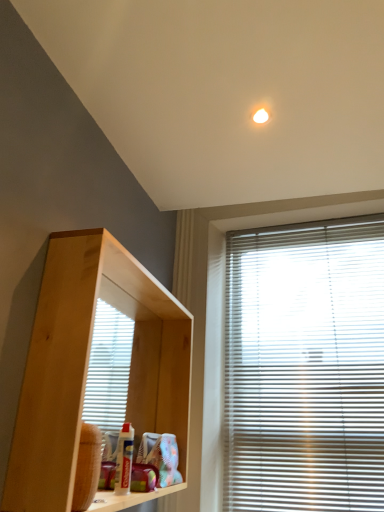
Locate an element on the screen. This screenshot has height=512, width=384. natural wood shelf at center is located at coordinates (88, 364).

What is the approximate width of natural wood shelf at center?

It is 14.93 centimeters.

This screenshot has width=384, height=512. What do you see at coordinates (88, 364) in the screenshot? I see `natural wood shelf at center` at bounding box center [88, 364].

The width and height of the screenshot is (384, 512). Describe the element at coordinates (305, 367) in the screenshot. I see `white plastic blinds at right` at that location.

Image resolution: width=384 pixels, height=512 pixels. What are the coordinates of `white plastic blinds at right` in the screenshot? It's located at (305, 367).

Image resolution: width=384 pixels, height=512 pixels. In order to click on natural wood shelf at center in this screenshot , I will do `click(88, 364)`.

Does natural wood shelf at center appear on the right side of white plastic blinds at right?

No.

In the image, is natural wood shelf at center positioned in front of or behind white plastic blinds at right?

natural wood shelf at center is in front of white plastic blinds at right.

Which is in front, point (27, 423) or point (286, 382)?

The point (27, 423) is in front.

From the image's perspective, which object appears higher, natural wood shelf at center or white plastic blinds at right?

natural wood shelf at center.

From a real-world perspective, which object stands above the other?

white plastic blinds at right.

Can you confirm if natural wood shelf at center is thinner than white plastic blinds at right?

No.

From the picture: In terms of height, does natural wood shelf at center look taller or shorter compared to white plastic blinds at right?

In the image, natural wood shelf at center appears to be shorter than white plastic blinds at right.

Can you confirm if natural wood shelf at center is bigger than white plastic blinds at right?

Yes, natural wood shelf at center is bigger than white plastic blinds at right.

Would you say natural wood shelf at center is inside or outside white plastic blinds at right?

The correct answer is: outside.

Are natural wood shelf at center and white plastic blinds at right far apart?

No, there isn't a large distance between natural wood shelf at center and white plastic blinds at right.

Is natural wood shelf at center facing away from white plastic blinds at right?

No, natural wood shelf at center's orientation is not away from white plastic blinds at right.

How many degrees apart are the facing directions of natural wood shelf at center and white plastic blinds at right?

natural wood shelf at center and white plastic blinds at right are facing 89.7 degrees away from each other.

Where is `window blind that is below the natural wood shelf at center (from the image's perspective)`? This screenshot has width=384, height=512. window blind that is below the natural wood shelf at center (from the image's perspective) is located at coordinates (305, 367).

Does white plastic blinds at right appear on the left side of natural wood shelf at center?

No.

Which object is closer to the camera, white plastic blinds at right or natural wood shelf at center?

Positioned in front is natural wood shelf at center.

Considering the positions of point (277, 285) and point (133, 275), is point (277, 285) closer or farther from the camera than point (133, 275)?

Point (277, 285) is positioned farther from the camera compared to point (133, 275).

From the image's perspective, is white plastic blinds at right located above natural wood shelf at center?

No, from the image's perspective, white plastic blinds at right is not over natural wood shelf at center.

From a real-world perspective, is white plastic blinds at right under natural wood shelf at center?

No.

Considering the sizes of white plastic blinds at right and natural wood shelf at center in the image, is white plastic blinds at right wider or thinner than natural wood shelf at center?

white plastic blinds at right is thinner than natural wood shelf at center.

From the picture: Between white plastic blinds at right and natural wood shelf at center, which one has less height?

natural wood shelf at center.

Does white plastic blinds at right have a larger size compared to natural wood shelf at center?

No, white plastic blinds at right is not bigger than natural wood shelf at center.

Is white plastic blinds at right completely or partially outside of natural wood shelf at center?

Indeed, white plastic blinds at right is completely outside natural wood shelf at center.

Are white plastic blinds at right and natural wood shelf at center beside each other?

white plastic blinds at right is not next to natural wood shelf at center, and they're not touching.

Based on the photo, is white plastic blinds at right oriented away from natural wood shelf at center?

That's not correct — white plastic blinds at right is not looking away from natural wood shelf at center.

How different are the orientations of white plastic blinds at right and natural wood shelf at center in degrees?

The facing directions of white plastic blinds at right and natural wood shelf at center are 89.7 degrees apart.

Where is `window blind below the natural wood shelf at center (from the image's perspective)`? The width and height of the screenshot is (384, 512). window blind below the natural wood shelf at center (from the image's perspective) is located at coordinates pyautogui.click(x=305, y=367).

The image size is (384, 512). Identify the location of shelf below the white plastic blinds at right (from a real-world perspective). (88, 364).

The height and width of the screenshot is (512, 384). In order to click on window blind on the right of natural wood shelf at center in this screenshot , I will do `click(305, 367)`.